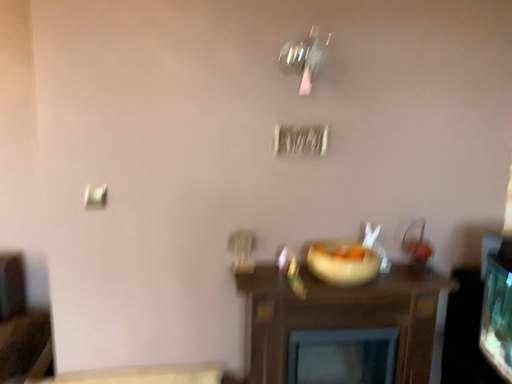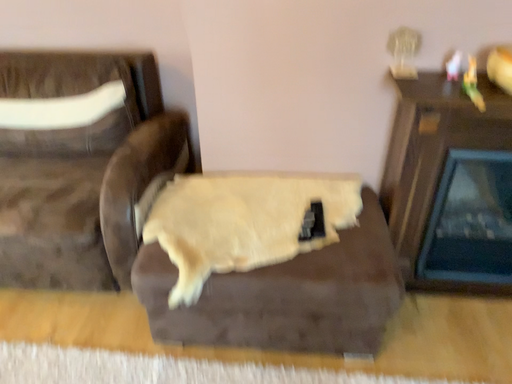
Question: How did the camera likely rotate when shooting the video?

Choices:
 (A) rotated upward
 (B) rotated downward

Answer: (B)